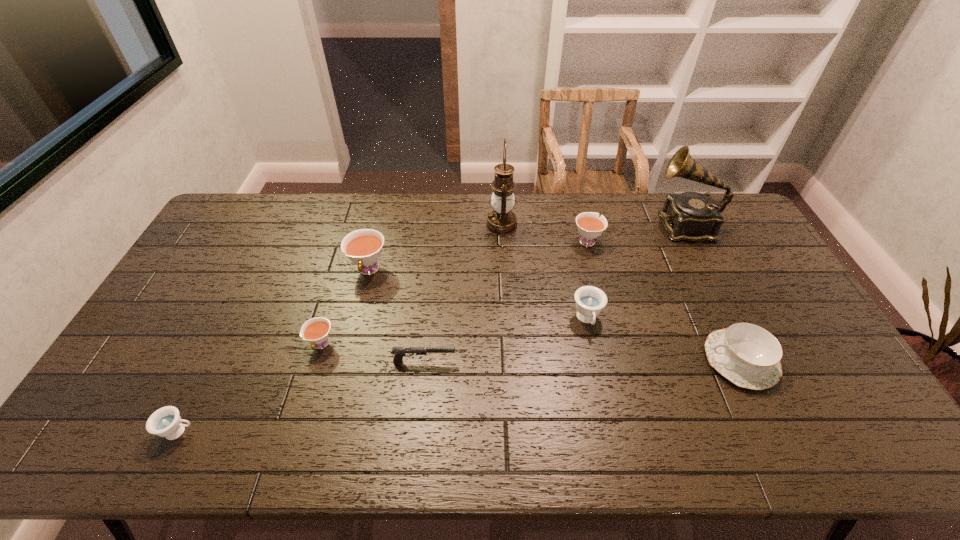
Locate an element on the screen. the nearest white teacup is located at coordinates (316, 330).

The width and height of the screenshot is (960, 540). Find the location of `gun`. gun is located at coordinates (399, 352).

You are a GUI agent. You are given a task and a screenshot of the screen. Output one action in this format:
    pyautogui.click(x=<x>, y=<y>)
    Task: Click on the gray gun
    
    Given the screenshot: What is the action you would take?
    pyautogui.click(x=399, y=352)

I want to click on the nearest teacup, so click(x=166, y=422).

The image size is (960, 540). Find the location of `the leftmost object`. the leftmost object is located at coordinates (166, 422).

Find the location of a particular element. vacant space located 0.240m on the left of the fifth object from right to left is located at coordinates (420, 225).

Image resolution: width=960 pixels, height=540 pixels. Find the location of `free location located on the horn of the second tallest object`. free location located on the horn of the second tallest object is located at coordinates (588, 225).

You are a GUI agent. You are given a task and a screenshot of the screen. Output one action in this format:
    pyautogui.click(x=<x>, y=<y>)
    Task: Click on the free region located 0.160m on the horn of the second tallest object
    The width and height of the screenshot is (960, 540).
    Given the screenshot: What is the action you would take?
    pyautogui.click(x=608, y=225)

What are the coordinates of `free space located 0.090m on the horn of the second tallest object` in the screenshot? It's located at (628, 225).

I want to click on free space located 0.260m on the side of the tallest teacup with the handle, so click(x=347, y=357).